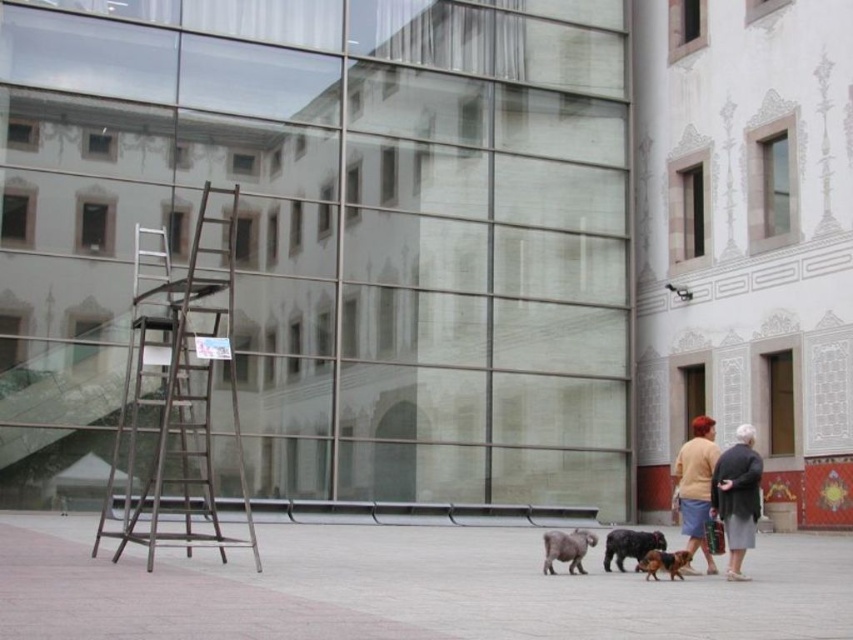
Who is more forward, (744, 577) or (695, 433)?

Point (744, 577) is in front.

Can you confirm if gray wool coat at lower right is positioned below matte yellow sweater at center?

A: No.

Who is more distant from viewer, (747,484) or (682,465)?

Point (682,465)

This screenshot has height=640, width=853. What are the coordinates of `gray wool coat at lower right` in the screenshot? It's located at (737, 497).

Does pavement at lower center have a lesser width compared to shiny black dog at center?

In fact, pavement at lower center might be wider than shiny black dog at center.

Is pavement at lower center to the left of shiny black dog at center from the viewer's perspective?

Yes, pavement at lower center is to the left of shiny black dog at center.

Is point (56, 580) farther from viewer compared to point (634, 541)?

No.

At what (x,y) coordinates should I click in order to perform the action: click on pavement at lower center. Please return your answer as a coordinate pair (x, y). Image resolution: width=853 pixels, height=640 pixels. Looking at the image, I should click on (403, 588).

Can you confirm if pavement at lower center is smaller than metallic ladder at left?

Yes.

Is point (764, 548) more distant than point (160, 486)?

Yes, point (764, 548) is behind point (160, 486).

Is point (381, 612) positioned after point (225, 429)?

That is False.

Locate an element on the screen. The image size is (853, 640). pavement at lower center is located at coordinates (403, 588).